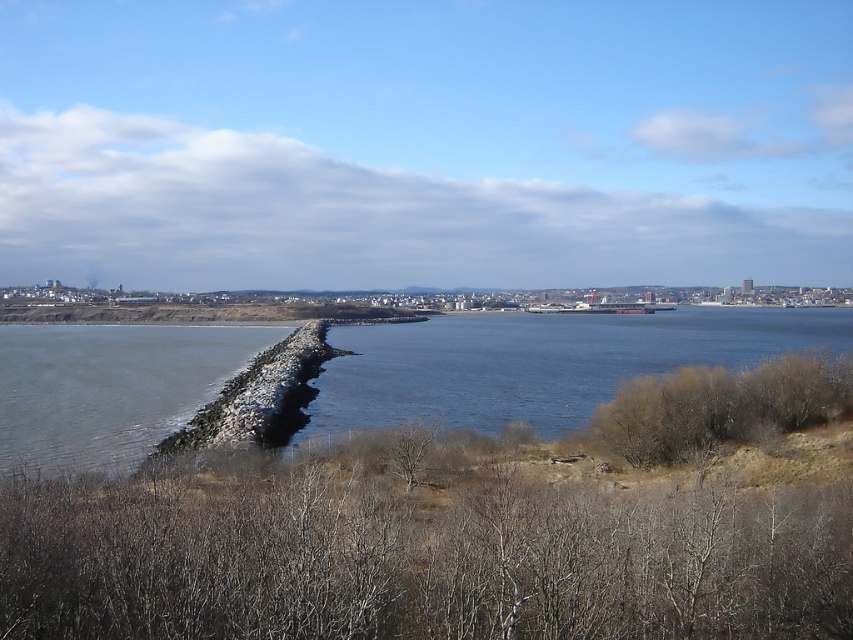
Who is positioned more to the left, dark gray concrete waterway at center or rocky jetty at lower left?

rocky jetty at lower left is more to the left.

Is dark gray concrete waterway at center shorter than rocky jetty at lower left?

No, dark gray concrete waterway at center is not shorter than rocky jetty at lower left.

Is point (596, 403) in front of point (4, 432)?

No, it is behind (4, 432).

This screenshot has height=640, width=853. Identify the location of dark gray concrete waterway at center. (540, 364).

Is dark gray concrete waterway at center further to camera compared to brown dry bush at lower right?

Yes, dark gray concrete waterway at center is behind brown dry bush at lower right.

The height and width of the screenshot is (640, 853). I want to click on dark gray concrete waterway at center, so pos(540,364).

Identify the location of dark gray concrete waterway at center. The image size is (853, 640). (540, 364).

In order to click on rocky jetty at lower left in this screenshot , I will do `click(109, 387)`.

Where is `rocky jetty at lower left`? The width and height of the screenshot is (853, 640). rocky jetty at lower left is located at coordinates (109, 387).